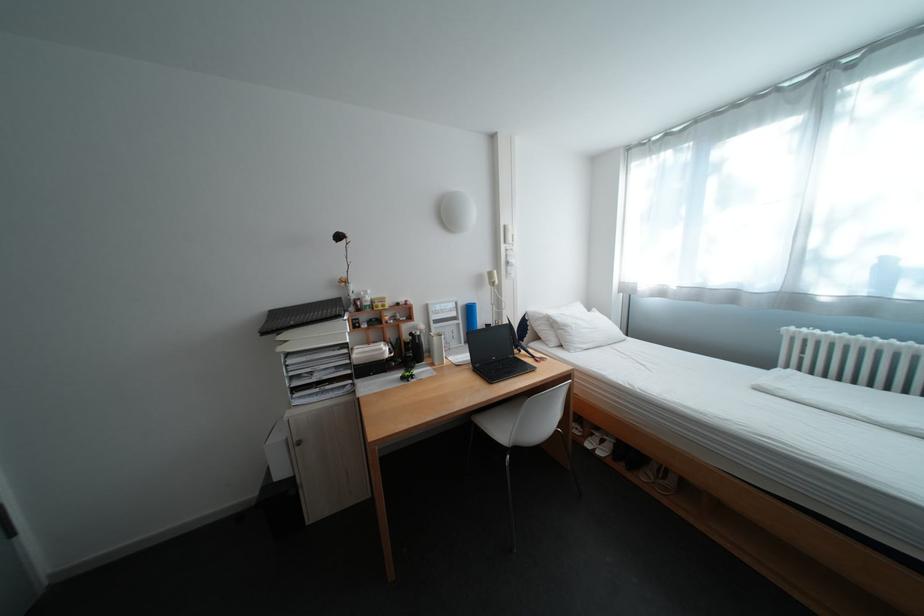
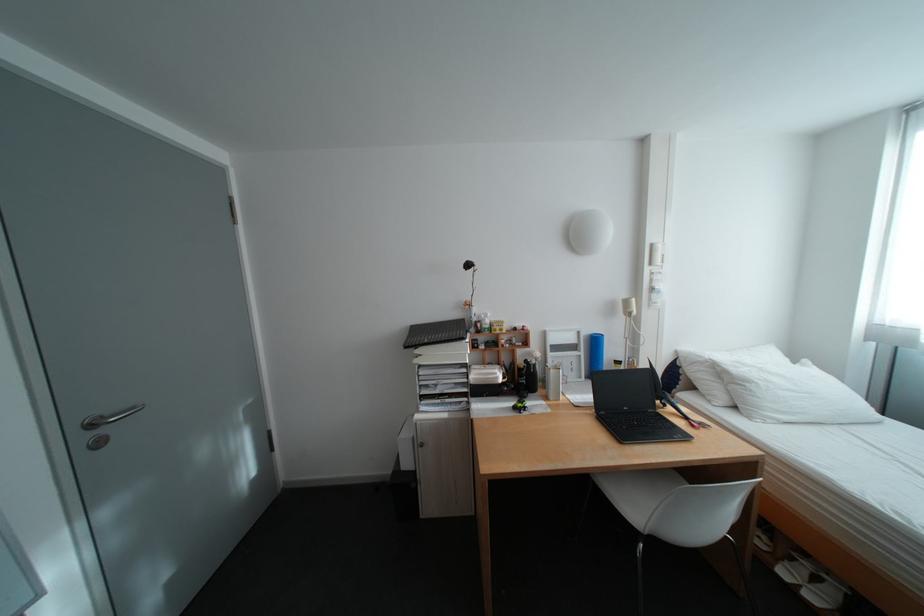
In the second image, find the point that corresponds to pixel 472 322 in the first image.

(594, 354)